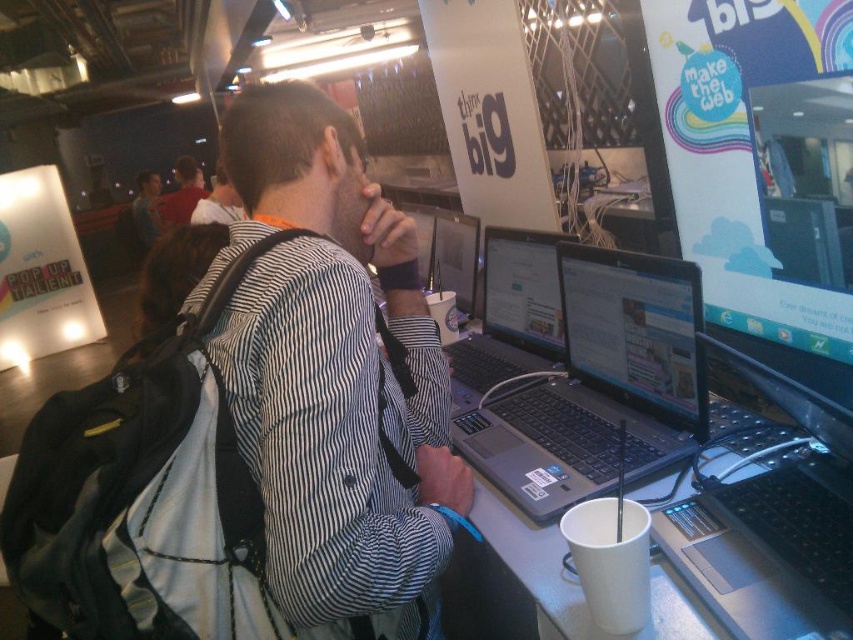
Can you confirm if striped fabric shirt at center is shorter than sleek silver laptop at center?

Incorrect, striped fabric shirt at center's height does not fall short of sleek silver laptop at center's.

Can you confirm if striped fabric shirt at center is positioned to the left of sleek silver laptop at center?

Correct, you'll find striped fabric shirt at center to the left of sleek silver laptop at center.

I want to click on striped fabric shirt at center, so click(x=334, y=371).

Does silver/black laptop at center appear on the right side of matte black laptop at center?

Indeed, silver/black laptop at center is positioned on the right side of matte black laptop at center.

Is point (614, 401) positioned after point (466, 250)?

No.

Where is `silver/black laptop at center`? silver/black laptop at center is located at coordinates (601, 387).

Which is in front, point (358, 346) or point (463, 419)?

Point (358, 346)

Is the position of striped fabric shirt at center more distant than that of silver/black laptop at center?

No, striped fabric shirt at center is closer to the viewer.

You are a GUI agent. You are given a task and a screenshot of the screen. Output one action in this format:
    pyautogui.click(x=<x>, y=<y>)
    Task: Click on the striped fabric shirt at center
    
    Given the screenshot: What is the action you would take?
    pyautogui.click(x=334, y=371)